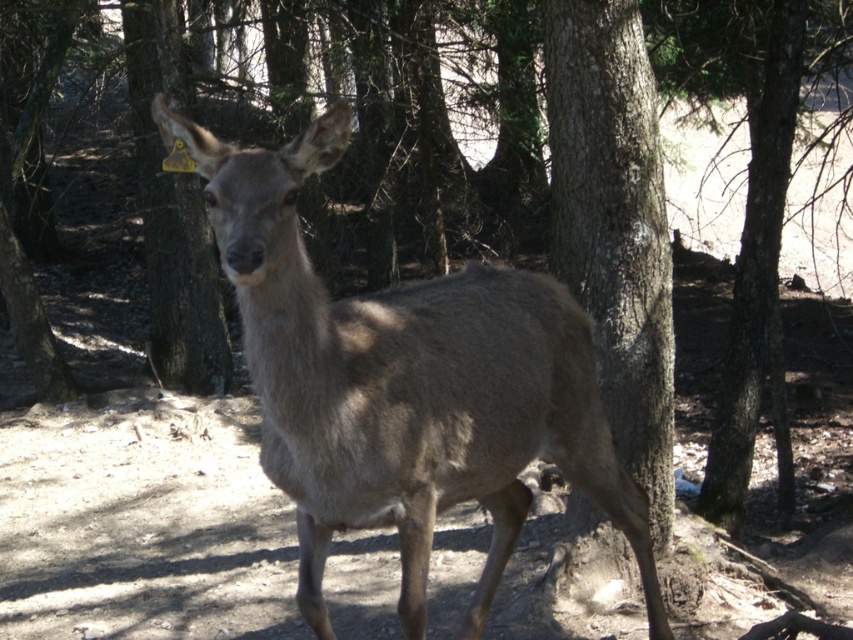
Question: Which point is closer to the camera taking this photo?

Choices:
 (A) (357, 390)
 (B) (589, 266)

Answer: (A)

Question: Which point is farther from the camera taking this photo?

Choices:
 (A) (645, 184)
 (B) (347, 444)

Answer: (A)

Question: Is gray fur deer at center bigger than rough bark tree at center?

Choices:
 (A) no
 (B) yes

Answer: (B)

Question: Among these objects, which one is nearest to the camera?

Choices:
 (A) rough bark tree at center
 (B) gray fur deer at center

Answer: (B)

Question: Does gray fur deer at center appear on the left side of rough bark tree at center?

Choices:
 (A) yes
 (B) no

Answer: (A)

Question: Is gray fur deer at center thinner than rough bark tree at center?

Choices:
 (A) yes
 (B) no

Answer: (B)